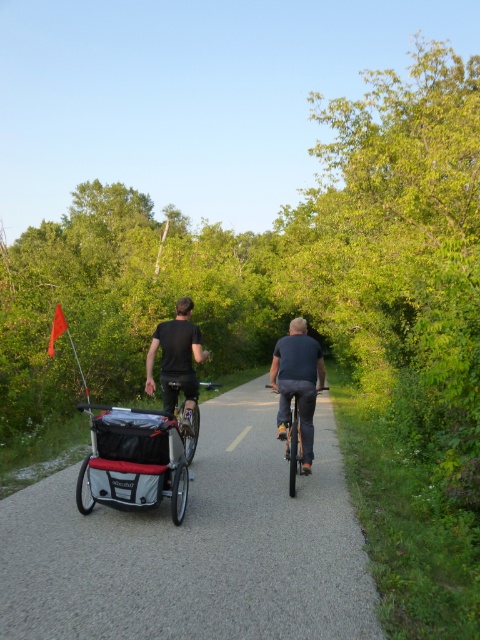
You are a photographer standing at the side of the path. You want to capture a photo where the black matte shirt at center is clearly visible above the shiny black bicycle at center. Based on the scene description, will this be possible?

Yes, because the black matte shirt at center is taller than the shiny black bicycle at center, allowing it to be visible above the bicycle in the photo.

You are a cyclist approaching the silver metallic cart at center and the shiny black bicycle at center on a shared path. Which object should you slow down for first?

You should slow down for the silver metallic cart at center first because it is in front of the shiny black bicycle at center along your path.